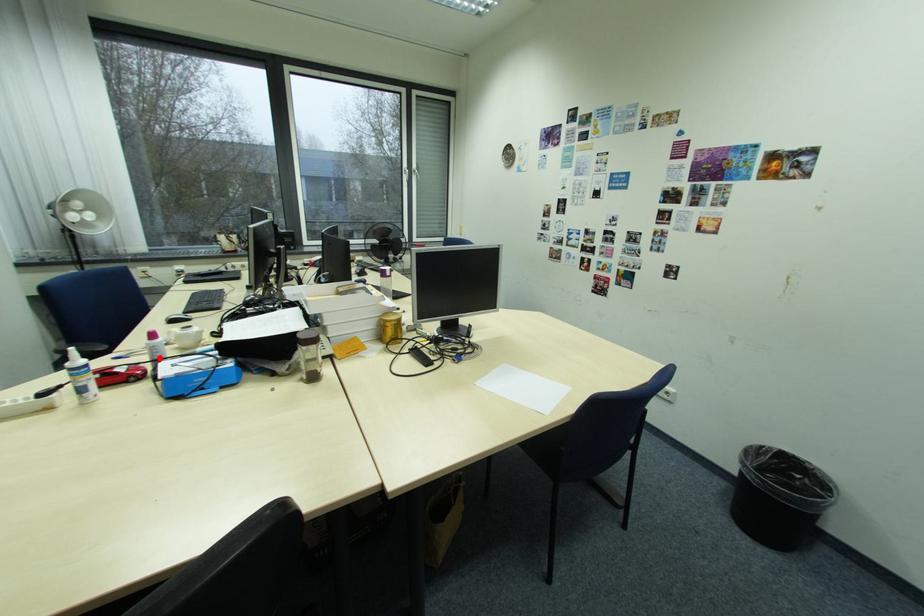
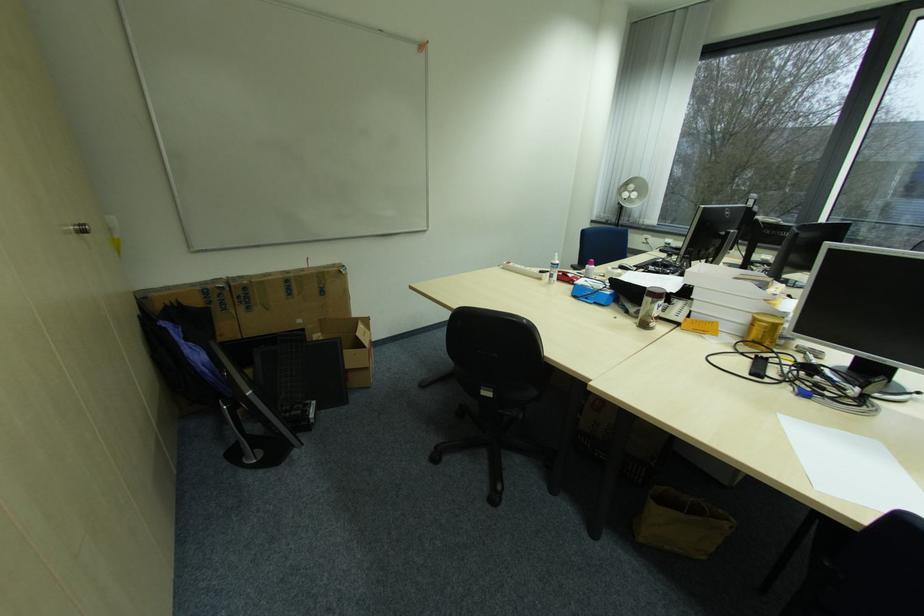
Question: I am providing you with two images of the same scene from different viewpoints. A red point is marked on the first image. Can you still see the location of the red point in image 2?

Choices:
 (A) Yes
 (B) No

Answer: (A)